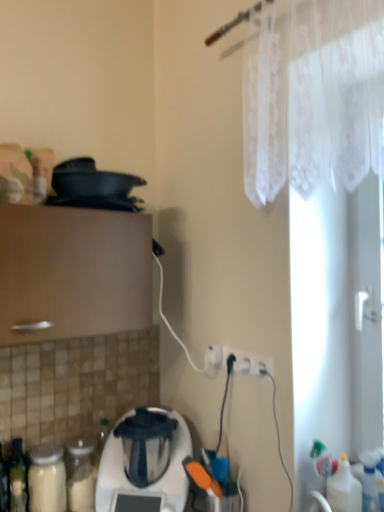
Question: Is translucent plastic bottle at lower right looking in the opposite direction of white plastic electric outlet at lower center?

Choices:
 (A) no
 (B) yes

Answer: (A)

Question: Does translucent plastic bottle at lower right appear on the left side of white plastic electric outlet at lower center?

Choices:
 (A) yes
 (B) no

Answer: (B)

Question: Is translucent plastic bottle at lower right to the right of white plastic electric outlet at lower center from the viewer's perspective?

Choices:
 (A) yes
 (B) no

Answer: (A)

Question: From the image's perspective, does translucent plastic bottle at lower right appear lower than white plastic electric outlet at lower center?

Choices:
 (A) no
 (B) yes

Answer: (B)

Question: Can you confirm if translucent plastic bottle at lower right is bigger than white plastic electric outlet at lower center?

Choices:
 (A) yes
 (B) no

Answer: (A)

Question: Is point (345, 168) positioned closer to the camera than point (271, 369)?

Choices:
 (A) farther
 (B) closer

Answer: (B)

Question: From the image's perspective, is white lace curtain at upper right located above or below white plastic electric outlet at lower center?

Choices:
 (A) above
 (B) below

Answer: (A)

Question: From a real-world perspective, is white lace curtain at upper right above or below white plastic electric outlet at lower center?

Choices:
 (A) below
 (B) above

Answer: (B)

Question: Do you think white lace curtain at upper right is within white plastic electric outlet at lower center, or outside of it?

Choices:
 (A) outside
 (B) inside

Answer: (A)

Question: In terms of width, does translucent plastic bottle at lower right look wider or thinner when compared to white lace curtain at upper right?

Choices:
 (A) thin
 (B) wide

Answer: (A)

Question: Relative to white lace curtain at upper right, is translucent plastic bottle at lower right in front or behind?

Choices:
 (A) front
 (B) behind

Answer: (B)

Question: From a real-world perspective, is translucent plastic bottle at lower right above or below white lace curtain at upper right?

Choices:
 (A) above
 (B) below

Answer: (B)

Question: From the image's perspective, is translucent plastic bottle at lower right positioned above or below white lace curtain at upper right?

Choices:
 (A) below
 (B) above

Answer: (A)

Question: In terms of width, does translucent plastic bottle at lower right look wider or thinner when compared to white plastic electric outlet at lower center?

Choices:
 (A) thin
 (B) wide

Answer: (B)

Question: Based on their positions, is translucent plastic bottle at lower right located to the left or right of white plastic electric outlet at lower center?

Choices:
 (A) left
 (B) right

Answer: (B)